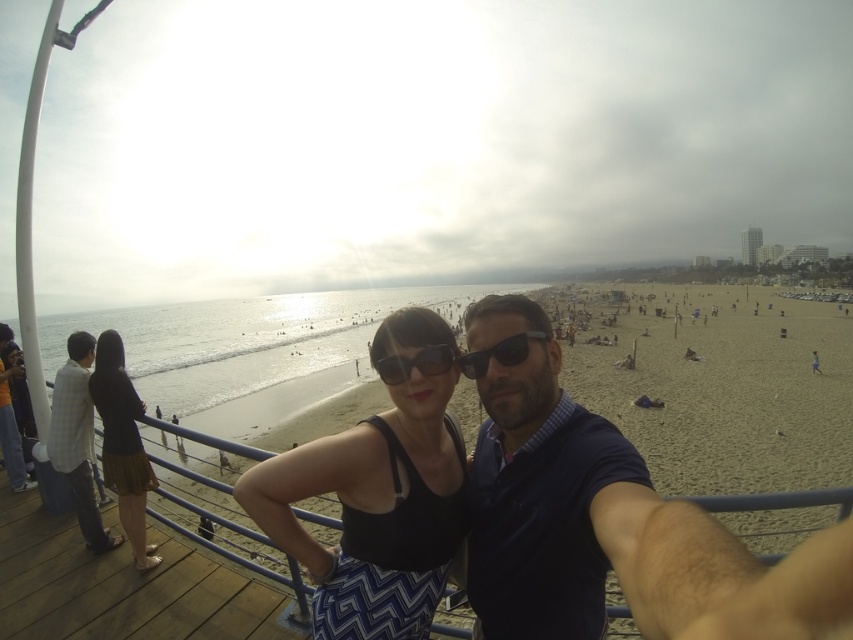
Is black matte tank top at center above matte black sunglasses at center?

No, black matte tank top at center is not above matte black sunglasses at center.

Is black matte tank top at center bigger than matte black sunglasses at center?

Yes, black matte tank top at center is bigger than matte black sunglasses at center.

Who is more forward, (357, 522) or (419, 365)?

Point (357, 522)

Image resolution: width=853 pixels, height=640 pixels. Identify the location of black matte tank top at center. (373, 513).

Does point (122, 353) come behind point (405, 371)?

Yes.

Between brown skirt at lower left and matte black sunglasses at center, which one appears on the left side from the viewer's perspective?

From the viewer's perspective, brown skirt at lower left appears more on the left side.

Find the location of a particular element. Image resolution: width=853 pixels, height=640 pixels. brown skirt at lower left is located at coordinates (122, 444).

Between black matte tank top at center and black plastic sunglasses at center, which one has less height?

black plastic sunglasses at center

The image size is (853, 640). What do you see at coordinates (373, 513) in the screenshot?
I see `black matte tank top at center` at bounding box center [373, 513].

At what (x,y) coordinates should I click in order to perform the action: click on black matte tank top at center. Please return your answer as a coordinate pair (x, y). The height and width of the screenshot is (640, 853). Looking at the image, I should click on (373, 513).